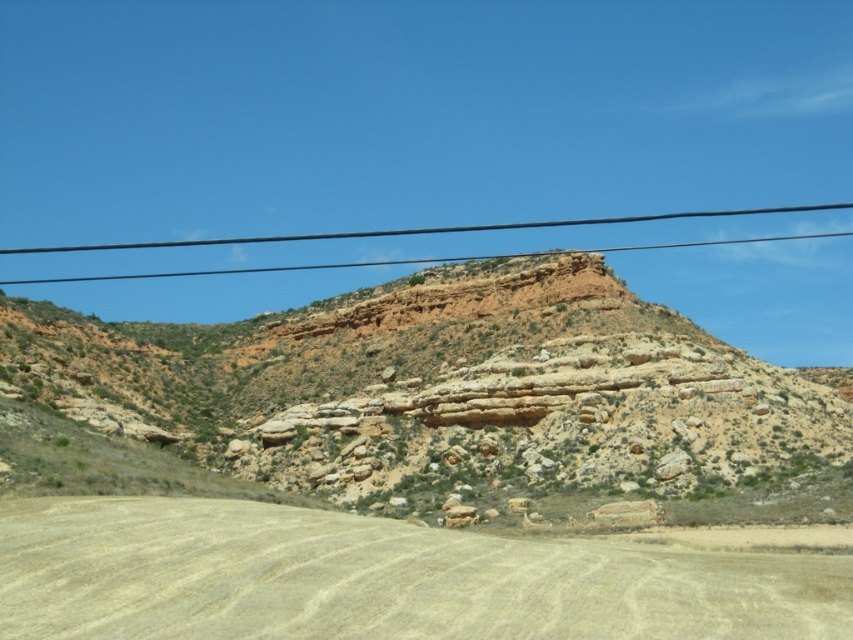
You are standing at the base of the hill in the midground of the image. You see a point marked at coordinates [459,397]. What does this point indicate?

The point at coordinates [459,397] indicates the location of the rustic rock formation at center.

You are a hiker standing at the base of the hill. You see the light brown dirt track at lower center and the black wire at upper center. Which object is closer to your current position?

The light brown dirt track at lower center is closer to your current position because it is located below the black wire at upper center, which is higher up.